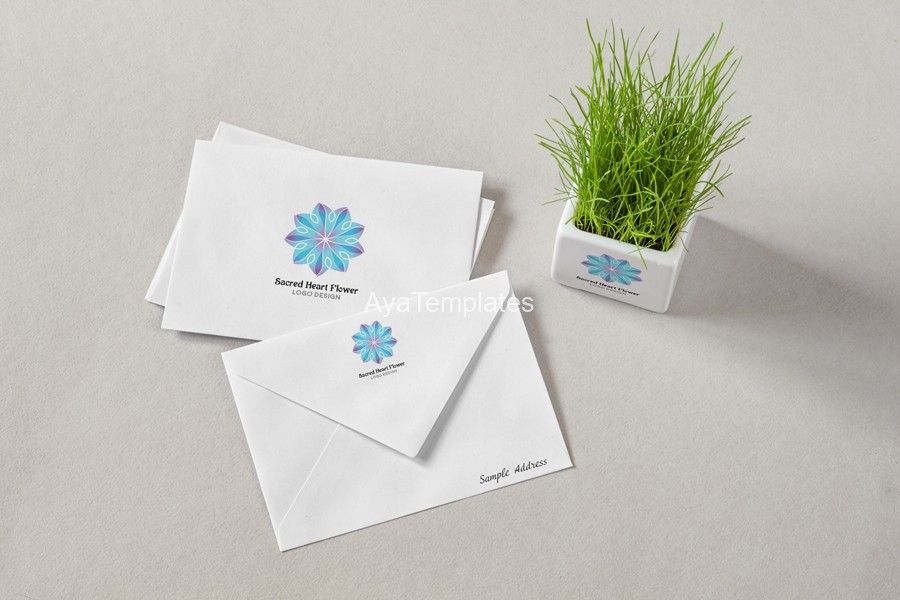
Identify the location of white planter on table. (652, 288).